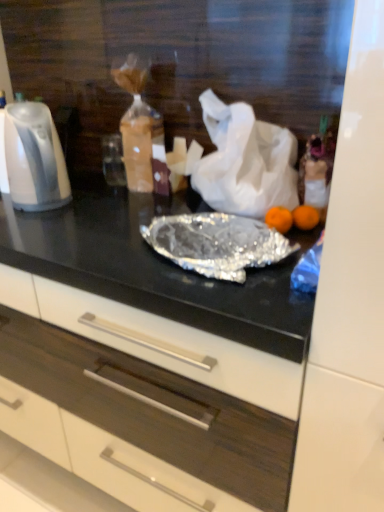
Question: Is white matte plastic bag at center taller than white glossy electric kettle at left?

Choices:
 (A) yes
 (B) no

Answer: (A)

Question: Is white matte plastic bag at center wider than white glossy electric kettle at left?

Choices:
 (A) no
 (B) yes

Answer: (B)

Question: From a real-world perspective, is white matte plastic bag at center under white glossy electric kettle at left?

Choices:
 (A) no
 (B) yes

Answer: (A)

Question: Considering the relative sizes of white matte plastic bag at center and white glossy electric kettle at left in the image provided, is white matte plastic bag at center shorter than white glossy electric kettle at left?

Choices:
 (A) no
 (B) yes

Answer: (A)

Question: Can you confirm if white matte plastic bag at center is smaller than white glossy electric kettle at left?

Choices:
 (A) no
 (B) yes

Answer: (A)

Question: Considering the relative sizes of white matte plastic bag at center and white glossy electric kettle at left in the image provided, is white matte plastic bag at center bigger than white glossy electric kettle at left?

Choices:
 (A) yes
 (B) no

Answer: (A)

Question: From a real-world perspective, is white matte drawer at center located beneath white matte plastic bag at center?

Choices:
 (A) yes
 (B) no

Answer: (A)

Question: Can you confirm if white matte drawer at center is taller than white matte plastic bag at center?

Choices:
 (A) no
 (B) yes

Answer: (B)

Question: Can you confirm if white matte drawer at center is positioned to the right of white matte plastic bag at center?

Choices:
 (A) no
 (B) yes

Answer: (A)

Question: Is white matte drawer at center thinner than white matte plastic bag at center?

Choices:
 (A) no
 (B) yes

Answer: (A)

Question: Does white matte drawer at center have a greater width compared to white matte plastic bag at center?

Choices:
 (A) yes
 (B) no

Answer: (A)

Question: From the image's perspective, is white matte drawer at center over white matte plastic bag at center?

Choices:
 (A) no
 (B) yes

Answer: (A)

Question: Is white matte drawer at center further to camera compared to white glossy electric kettle at left?

Choices:
 (A) no
 (B) yes

Answer: (A)